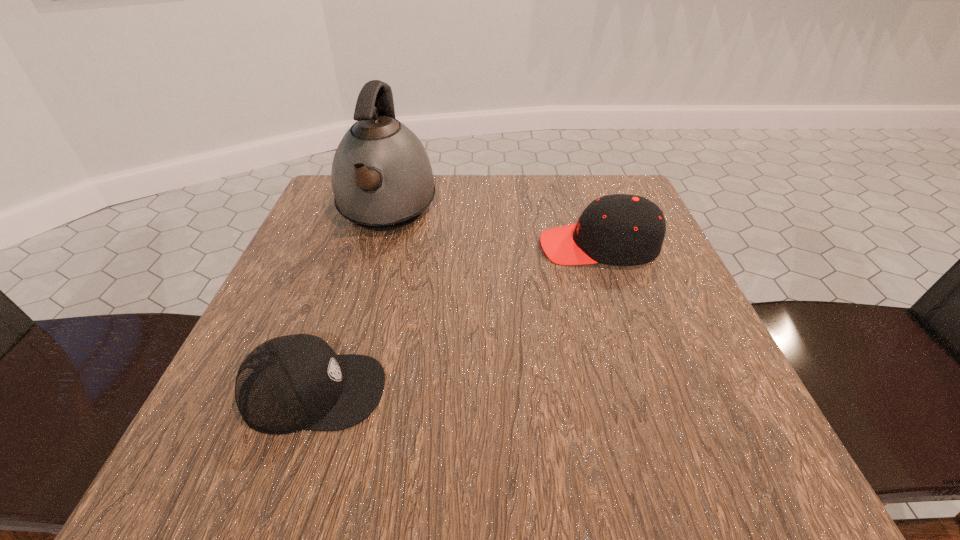
Find the location of `free space at the near edge`. free space at the near edge is located at coordinates (492, 426).

The image size is (960, 540). In the image, there is a desktop. Identify the location of free space at the left edge. (352, 241).

This screenshot has height=540, width=960. Identify the location of vacant space at the right edge of the desktop. (661, 286).

In the image, there is a desktop. What are the coordinates of `free region at the far left corner` in the screenshot? It's located at (331, 190).

Image resolution: width=960 pixels, height=540 pixels. In order to click on vacant space at the near left corner of the desktop in this screenshot , I will do pyautogui.click(x=239, y=478).

Image resolution: width=960 pixels, height=540 pixels. In the image, there is a desktop. Identify the location of vacant space at the far right corner. (599, 175).

In the image, there is a desktop. Where is `vacant space at the near right corner`? This screenshot has width=960, height=540. vacant space at the near right corner is located at coordinates (758, 440).

Find the location of a particular element. vacant area that lies between the nearest object and the kettle is located at coordinates (350, 302).

The width and height of the screenshot is (960, 540). I want to click on free space that is in between the tallest object and the farther cap, so click(x=492, y=230).

Where is `empty location between the kettle and the nearest object`? This screenshot has height=540, width=960. empty location between the kettle and the nearest object is located at coordinates 350,302.